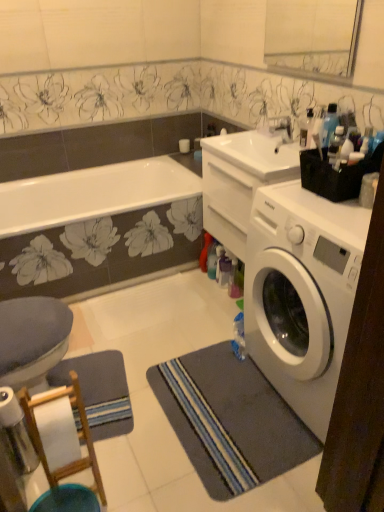
Image resolution: width=384 pixels, height=512 pixels. Describe the element at coordinates (257, 154) in the screenshot. I see `white glossy sink at upper center` at that location.

Identify the location of white glossy sink at upper center. (257, 154).

This screenshot has height=512, width=384. What are the coordinates of `blue fabric toilet at lower left` in the screenshot? It's located at (32, 340).

Measure the distance between translucent plastic bottle at upper right, the second bottle viewed from the back, and camera.

A distance of 1.49 meters exists between translucent plastic bottle at upper right, the second bottle viewed from the back, and camera.

Locate an element on the screen. white glossy sink at upper center is located at coordinates coord(257,154).

From the image's perspective, between blue fabric toilet at lower left and white plastic washing machine at right, which one is located above?

white plastic washing machine at right, from the image's perspective.

Is blue fabric toilet at lower left in front of or behind white plastic washing machine at right in the image?

blue fabric toilet at lower left is positioned farther from the viewer than white plastic washing machine at right.

Is blue fabric toilet at lower left completely or partially outside of white plastic washing machine at right?

Yes, blue fabric toilet at lower left is located beyond the bounds of white plastic washing machine at right.

The image size is (384, 512). What are the coordinates of `mirror on the right side of white glossy faucet at upper center` in the screenshot? It's located at (313, 36).

Is white glossy faucet at upper center bigger than clear glass mirror at upper center?

No, white glossy faucet at upper center is not bigger than clear glass mirror at upper center.

From the image's perspective, is white glossy faucet at upper center over clear glass mirror at upper center?

Actually, white glossy faucet at upper center appears below clear glass mirror at upper center in the image.

Can you confirm if transparent plastic bottle at upper right, the 2th bottle positioned from the front, is bigger than blue fabric toilet at lower left?

Incorrect, transparent plastic bottle at upper right, the 2th bottle positioned from the front, is not larger than blue fabric toilet at lower left.

Between transparent plastic bottle at upper right, the 2th bottle positioned from the front, and blue fabric toilet at lower left, which one appears on the left side from the viewer's perspective?

blue fabric toilet at lower left.

Which object is more forward, transparent plastic bottle at upper right, the first bottle from the top, or blue fabric toilet at lower left?

Positioned in front is blue fabric toilet at lower left.

Is blue fabric toilet at lower left taller than white glossy faucet at upper center?

Incorrect, the height of blue fabric toilet at lower left is not larger of that of white glossy faucet at upper center.

Considering the sizes of objects blue fabric toilet at lower left and white glossy faucet at upper center in the image provided, who is wider, blue fabric toilet at lower left or white glossy faucet at upper center?

blue fabric toilet at lower left.

Is blue fabric toilet at lower left turned away from white glossy faucet at upper center?

No, blue fabric toilet at lower left's orientation is not away from white glossy faucet at upper center.

Is point (25, 385) closer or farther from the camera than point (282, 126)?

Point (25, 385) appears to be closer to the viewer than point (282, 126).

Which of these two, white wood bar stool at lower left or white glossy sink at upper center, stands shorter?

With less height is white glossy sink at upper center.

Consider the image. Is white wood bar stool at lower left facing away from white glossy sink at upper center?

white wood bar stool at lower left does not have its back to white glossy sink at upper center.

In terms of size, does white wood bar stool at lower left appear bigger or smaller than white glossy sink at upper center?

white wood bar stool at lower left is bigger than white glossy sink at upper center.

In the scene shown: Does white plastic washing machine at right contain blue striped yoga mat at lower left?

No, blue striped yoga mat at lower left is not inside white plastic washing machine at right.

Identify the location of yoga mat that is below the white plastic washing machine at right (from the image's perspective). (99, 391).

Which of these two, white plastic washing machine at right or blue striped yoga mat at lower left, stands shorter?

blue striped yoga mat at lower left is shorter.

Consider the image. Does white wood bar stool at lower left contain clear glass mirror at upper center?

No, clear glass mirror at upper center is located outside of white wood bar stool at lower left.

From a real-world perspective, who is located lower, white wood bar stool at lower left or clear glass mirror at upper center?

In real-world perspective, white wood bar stool at lower left is lower.

Which of these two, white wood bar stool at lower left or clear glass mirror at upper center, is wider?

white wood bar stool at lower left.

Considering the sizes of objects white wood bar stool at lower left and clear glass mirror at upper center in the image provided, who is shorter, white wood bar stool at lower left or clear glass mirror at upper center?

With less height is clear glass mirror at upper center.

Image resolution: width=384 pixels, height=512 pixels. I want to click on toilet below the white plastic washing machine at right (from a real-world perspective), so click(x=32, y=340).

Image resolution: width=384 pixels, height=512 pixels. I want to click on faucet on the left of the clear glass mirror at upper center, so click(281, 128).

Which object lies further to the anchor point clear glass mirror at upper center, white wood bar stool at lower left or white glossy sink at upper center?

Based on the image, white wood bar stool at lower left appears to be further to clear glass mirror at upper center.

Which object lies nearer to the anchor point white plastic washing machine at right, blue fabric toilet at lower left or clear glass mirror at upper center?

A: Based on the image, blue fabric toilet at lower left appears to be nearer to white plastic washing machine at right.

Which object lies further to the anchor point blue striped yoga mat at lower left, clear glass mirror at upper center or white glossy faucet at upper center?

clear glass mirror at upper center.

From the picture: Based on their spatial positions, is blue striped yoga mat at lower left or transparent plastic bottle at upper right, which is counted as the first bottle, starting from the back, closer to gray striped bath mat at lower right?

blue striped yoga mat at lower left lies closer to gray striped bath mat at lower right than the other object.

Which object lies nearer to the anchor point transparent plastic bottle at upper right, marked as the 2th bottle in a bottom-to-top arrangement, translucent plastic bottle at upper right, the second bottle viewed from the back, or clear glass mirror at upper center?

translucent plastic bottle at upper right, the second bottle viewed from the back, is closer to transparent plastic bottle at upper right, marked as the 2th bottle in a bottom-to-top arrangement.

Based on their spatial positions, is white wood bar stool at lower left or gray striped bath mat at lower right further from white plastic washing machine at right?

Among the two, white wood bar stool at lower left is located further to white plastic washing machine at right.

Looking at the image, which one is located further to translucent plastic bottle at upper right, the second bottle viewed from the back, white glossy faucet at upper center or white plastic washing machine at right?

white glossy faucet at upper center lies further to translucent plastic bottle at upper right, the second bottle viewed from the back, than the other object.

From the image, which object appears to be nearer to white glossy sink at upper center, white wood bar stool at lower left or clear glass mirror at upper center?

The object closer to white glossy sink at upper center is white wood bar stool at lower left.

Find the location of `yoga mat between translucent plastic bottle at upper right, which ranks as the first bottle in front-to-back order, and gray striped bath mat at lower right from top to bottom`. yoga mat between translucent plastic bottle at upper right, which ranks as the first bottle in front-to-back order, and gray striped bath mat at lower right from top to bottom is located at coordinates (99, 391).

Find the location of a particular element. This screenshot has width=384, height=512. bar stool that lies between white glossy faucet at upper center and blue striped yoga mat at lower left from top to bottom is located at coordinates (78, 434).

The width and height of the screenshot is (384, 512). I want to click on bar stool situated between blue fabric toilet at lower left and transparent plastic bottle at upper right, which is counted as the first bottle, starting from the back, from left to right, so click(x=78, y=434).

Where is `sink between white plastic washing machine at right and white glossy faucet at upper center in the front-back direction`? sink between white plastic washing machine at right and white glossy faucet at upper center in the front-back direction is located at coordinates (257, 154).